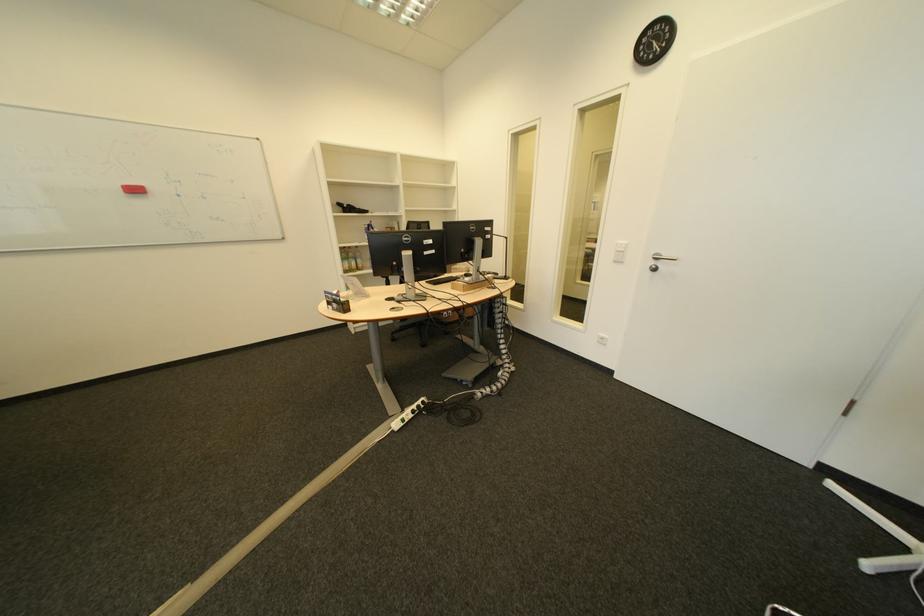
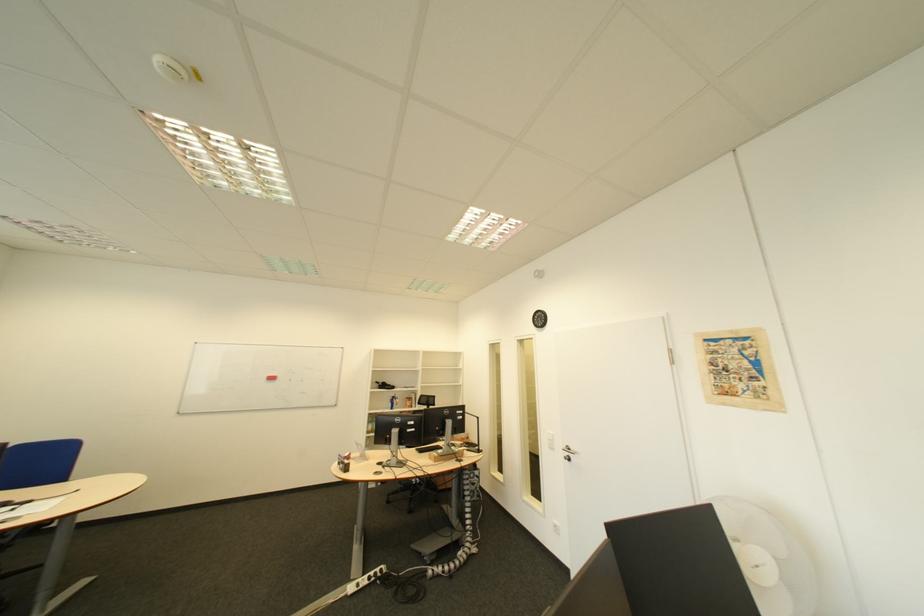
Find the pixel in the second image that matches [359,207] in the first image.

(393, 385)